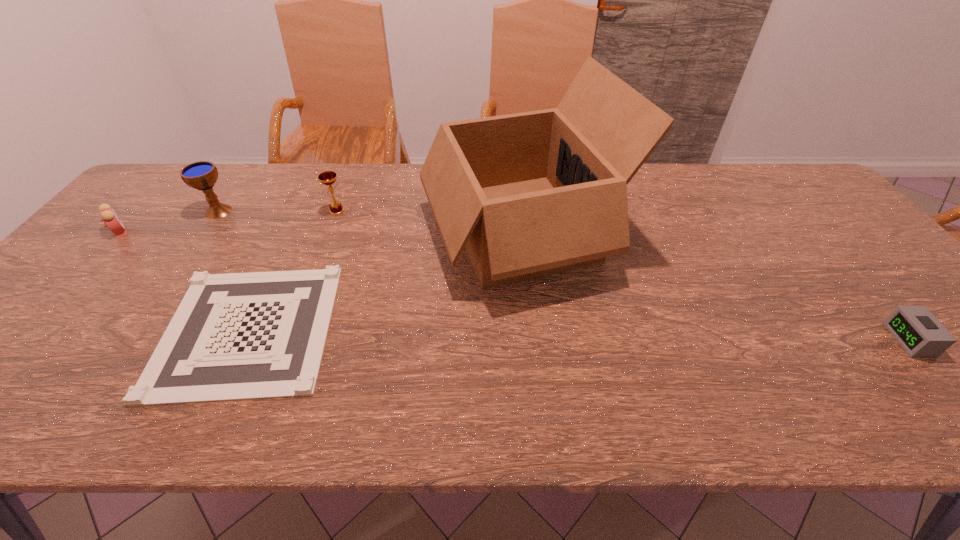
I want to click on the second object from right to left, so click(532, 194).

At what (x,y) coordinates should I click in order to perform the action: click on the tallest object. Please return your answer as a coordinate pair (x, y). The height and width of the screenshot is (540, 960). Looking at the image, I should click on (532, 194).

Identify the location of the left chalice. This screenshot has height=540, width=960. (202, 175).

You are a GUI agent. You are given a task and a screenshot of the screen. Output one action in this format:
    pyautogui.click(x=<x>, y=<y>)
    Task: Click on the taller chalice
    
    Given the screenshot: What is the action you would take?
    (x=202, y=175)

At what (x,y) coordinates should I click in order to perform the action: click on the shorter chalice. Please return your answer as a coordinate pair (x, y). The height and width of the screenshot is (540, 960). Looking at the image, I should click on (328, 178).

Where is `the fourth shortest object`? Image resolution: width=960 pixels, height=540 pixels. the fourth shortest object is located at coordinates (328, 178).

Find the location of a particular element. Image resolution: width=960 pixels, height=540 pixels. the third shortest object is located at coordinates (109, 217).

The width and height of the screenshot is (960, 540). I want to click on the farther alarm clock, so click(x=109, y=217).

The height and width of the screenshot is (540, 960). I want to click on the shorter alarm clock, so click(x=916, y=329).

The image size is (960, 540). Identify the location of the rightmost object. (916, 329).